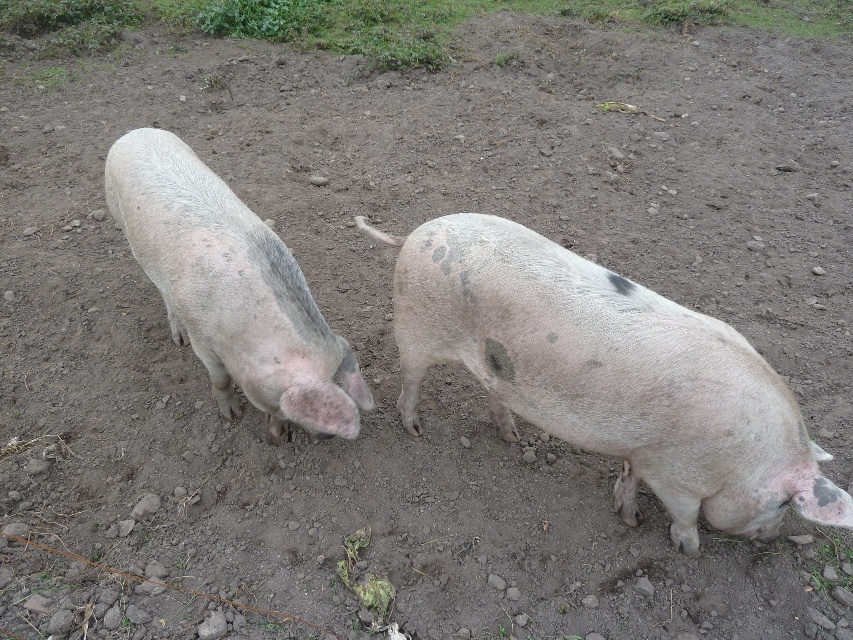
Can you confirm if speckled pink pig at right is positioned above gray matte pig at left?

Incorrect, speckled pink pig at right is not positioned above gray matte pig at left.

Does point (743, 465) come closer to viewer compared to point (117, 202)?

Yes, it is.

Who is more forward, (669,337) or (268,317)?

Point (669,337) is more forward.

Identify the location of speckled pink pig at right. This screenshot has height=640, width=853. (607, 376).